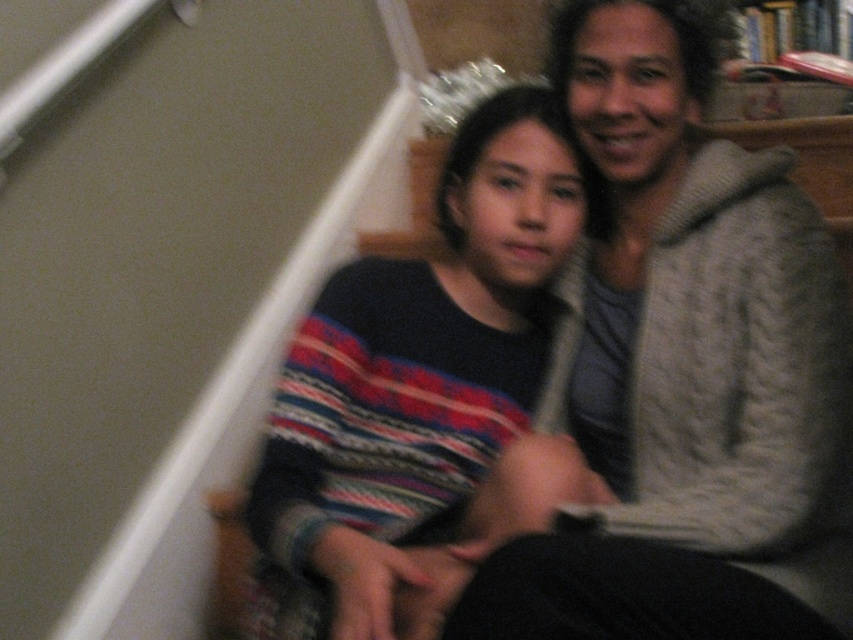
Is knitted gray sweater at upper right closer to camera compared to striped sweater at center?

Yes, knitted gray sweater at upper right is closer to the viewer.

Where is `knitted gray sweater at upper right`? The image size is (853, 640). knitted gray sweater at upper right is located at coordinates (686, 368).

In order to click on knitted gray sweater at upper right in this screenshot , I will do `click(686, 368)`.

Where is `knitted gray sweater at upper right`? The width and height of the screenshot is (853, 640). knitted gray sweater at upper right is located at coordinates (686, 368).